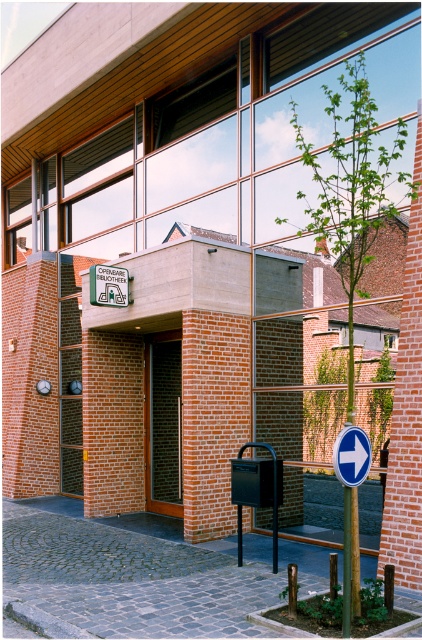
Image resolution: width=422 pixels, height=640 pixels. I want to click on brown wooden door at center, so click(x=164, y=422).

Between brown wooden door at center and white plastic sign at lower right, which one is positioned higher?

white plastic sign at lower right

Which is in front, point (178, 506) or point (346, 484)?

Point (346, 484)

The width and height of the screenshot is (422, 640). I want to click on brown wooden door at center, so click(x=164, y=422).